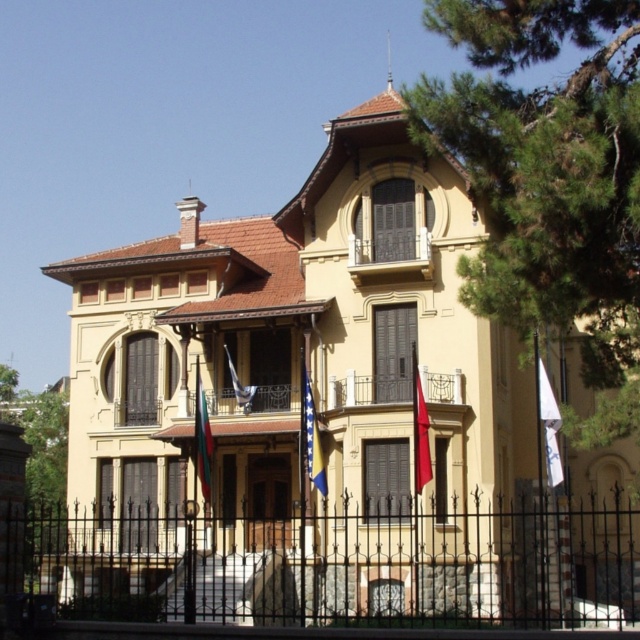
Question: Does green leafy tree at right come in front of red fabric flag at center?

Choices:
 (A) no
 (B) yes

Answer: (B)

Question: Which point appears farthest from the camera in this image?

Choices:
 (A) (544, 404)
 (B) (209, 490)
 (C) (241, 385)

Answer: (C)

Question: Considering the relative positions of metallic balcony at center and red fabric flag at center in the image provided, where is metallic balcony at center located with respect to red fabric flag at center?

Choices:
 (A) above
 (B) below

Answer: (A)

Question: In this image, where is metallic balcony at center located relative to striped fabric flag at center?

Choices:
 (A) above
 (B) below

Answer: (A)

Question: Which point is farther to the camera?

Choices:
 (A) metallic balcony at center
 (B) black wrought iron fence at center

Answer: (A)

Question: Which point is closer to the camera taking this photo?

Choices:
 (A) (557, 193)
 (B) (202, 438)

Answer: (A)